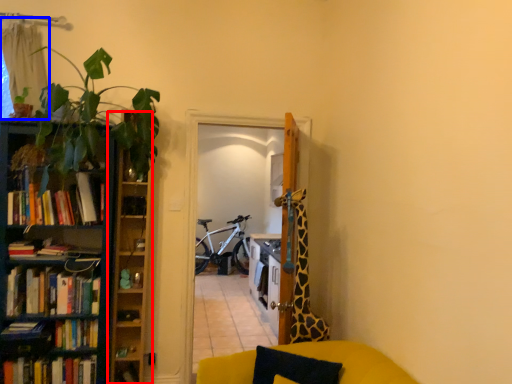
Question: Which object is further to the camera taking this photo, cabinet (highlighted by a red box) or curtain (highlighted by a blue box)?

Choices:
 (A) cabinet
 (B) curtain

Answer: (A)